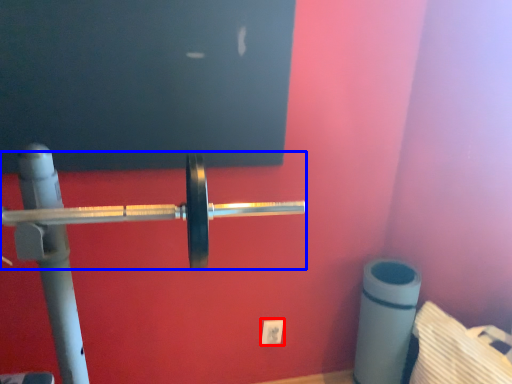
Question: Which of the following is the closest to the observer, power plugs and sockets (highlighted by a red box) or barbell (highlighted by a blue box)?

Choices:
 (A) power plugs and sockets
 (B) barbell

Answer: (B)